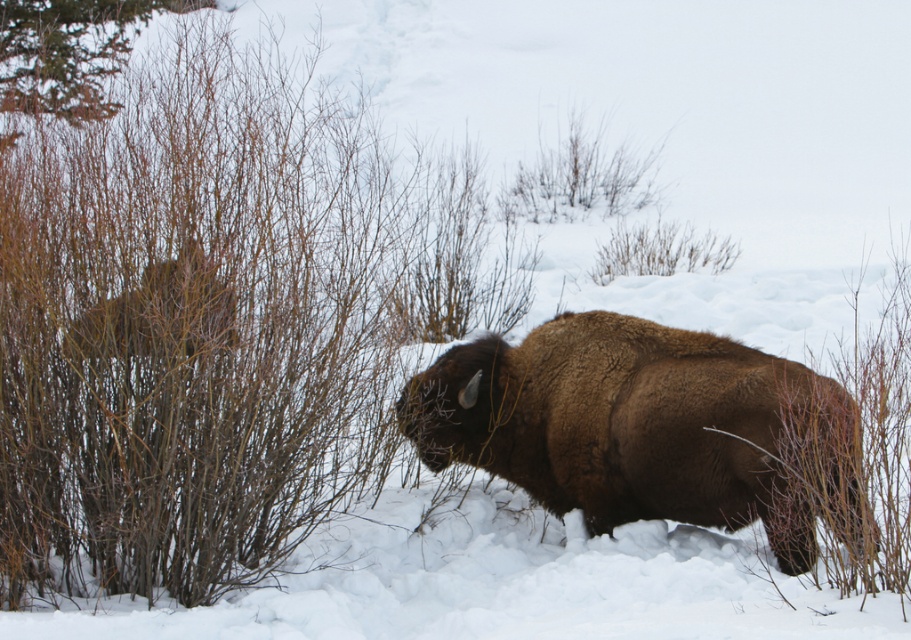
Is brown woody bush at left shorter than brown furry bison at center?

No, brown woody bush at left is not shorter than brown furry bison at center.

Does brown woody bush at left have a greater height compared to brown furry bison at center?

Correct, brown woody bush at left is much taller as brown furry bison at center.

Is point (254, 348) closer to camera compared to point (844, 468)?

No, it is behind (844, 468).

Identify the location of brown woody bush at left. Image resolution: width=911 pixels, height=640 pixels. (193, 324).